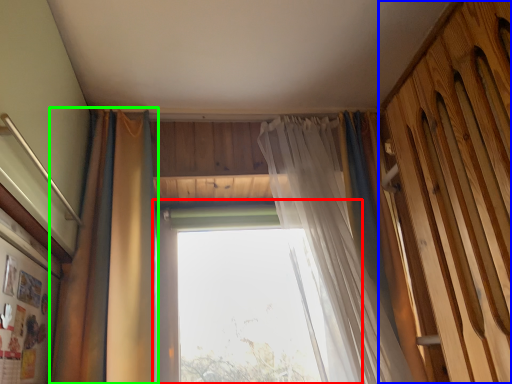
Question: Which is nearer to the window (highlighted by a red box)? barn door (highlighted by a blue box) or curtain (highlighted by a green box).

Choices:
 (A) barn door
 (B) curtain

Answer: (B)